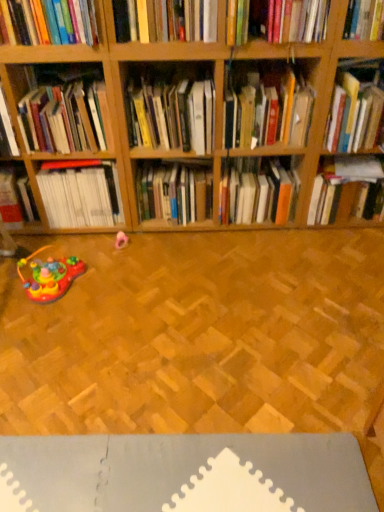
Image resolution: width=384 pixels, height=512 pixels. In order to click on vacant space positioned to the left of pink rubber duck at center, which is counted as the 2th toy, starting from the bottom in this screenshot , I will do `click(96, 245)`.